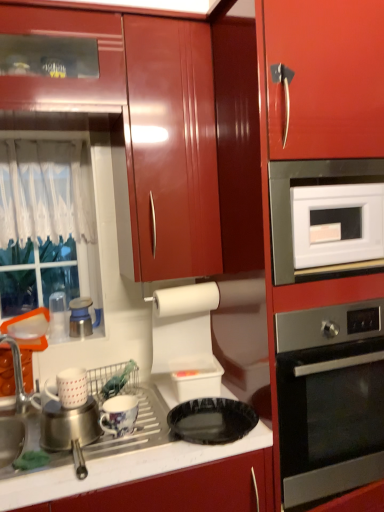
Question: Is white matte mug at lower left, positioned as the second appliance in right-to-left order, far away from glossy wood cabinet at upper center?

Choices:
 (A) no
 (B) yes

Answer: (A)

Question: Is white matte mug at lower left, which is the 2th appliance in top-to-bottom order, thinner than glossy wood cabinet at upper center?

Choices:
 (A) no
 (B) yes

Answer: (B)

Question: Is white matte mug at lower left, the third appliance in the back-to-front sequence, further to camera compared to glossy wood cabinet at upper center?

Choices:
 (A) no
 (B) yes

Answer: (B)

Question: Can you confirm if white matte mug at lower left, which is counted as the second appliance, starting from the left, is wider than glossy wood cabinet at upper center?

Choices:
 (A) yes
 (B) no

Answer: (B)

Question: Is white matte mug at lower left, positioned as the second appliance in right-to-left order, positioned with its back to glossy wood cabinet at upper center?

Choices:
 (A) yes
 (B) no

Answer: (B)

Question: Is white matte mug at lower left, positioned as the second appliance in right-to-left order, completely or partially outside of glossy wood cabinet at upper center?

Choices:
 (A) no
 (B) yes

Answer: (B)

Question: Does brushed metal sink at lower left have a smaller size compared to white sheer curtain at left?

Choices:
 (A) yes
 (B) no

Answer: (A)

Question: Considering the relative sizes of brushed metal sink at lower left and white sheer curtain at left in the image provided, is brushed metal sink at lower left shorter than white sheer curtain at left?

Choices:
 (A) yes
 (B) no

Answer: (A)

Question: From a real-world perspective, is brushed metal sink at lower left located higher than white sheer curtain at left?

Choices:
 (A) no
 (B) yes

Answer: (A)

Question: Is brushed metal sink at lower left to the right of white sheer curtain at left from the viewer's perspective?

Choices:
 (A) yes
 (B) no

Answer: (A)

Question: Would you say brushed metal sink at lower left contains white sheer curtain at left?

Choices:
 (A) no
 (B) yes

Answer: (A)

Question: From a real-world perspective, is brushed metal sink at lower left below white sheer curtain at left?

Choices:
 (A) yes
 (B) no

Answer: (A)

Question: Does black glossy plate at lower center have a larger size compared to glossy ceramic mug at lower center, arranged as the first appliance when viewed from the right?

Choices:
 (A) yes
 (B) no

Answer: (A)